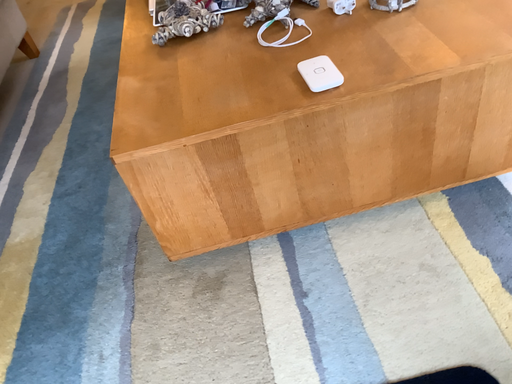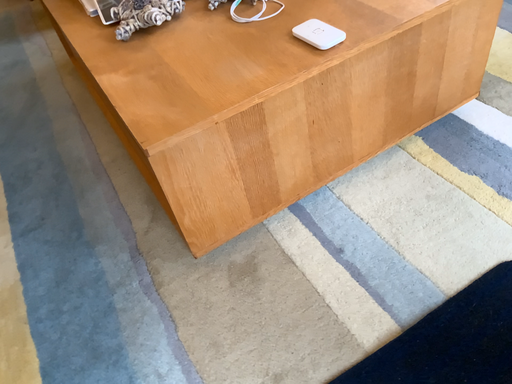
Question: Which way did the camera rotate in the video?

Choices:
 (A) rotated right
 (B) rotated left

Answer: (A)